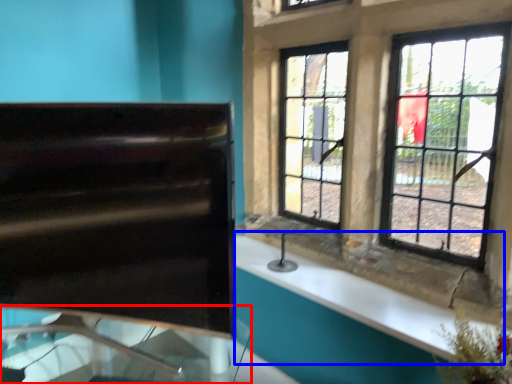
Question: Which of the following is the closest to the observer, glass table (highlighted by a red box) or counter top (highlighted by a blue box)?

Choices:
 (A) glass table
 (B) counter top

Answer: (A)